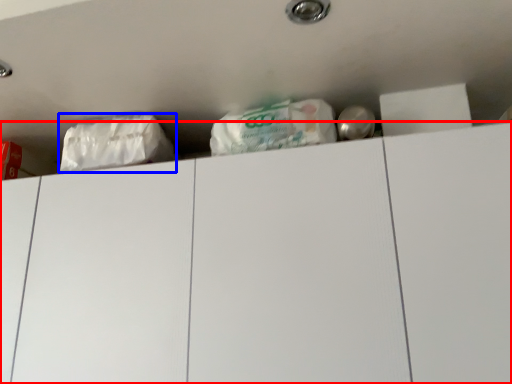
Question: Which point is further to the camera, drawer (highlighted by a red box) or plastic bag (highlighted by a blue box)?

Choices:
 (A) drawer
 (B) plastic bag

Answer: (B)